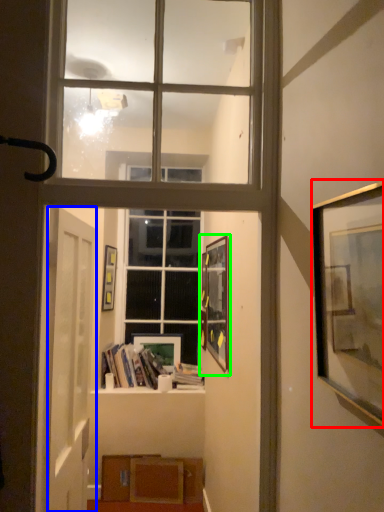
Question: Which is farther away from picture frame (highlighted by a red box)? door (highlighted by a blue box) or picture frame (highlighted by a green box)?

Choices:
 (A) door
 (B) picture frame

Answer: (B)